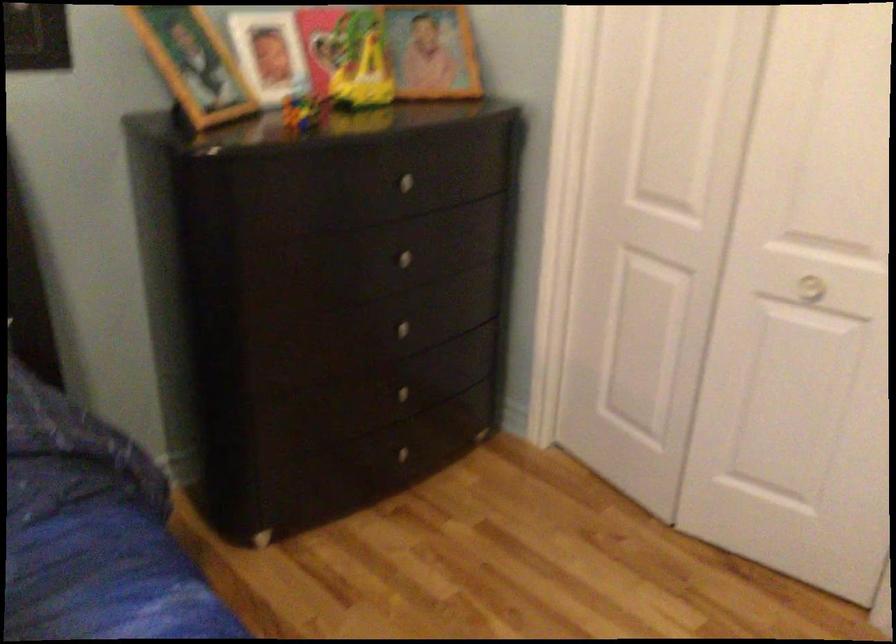
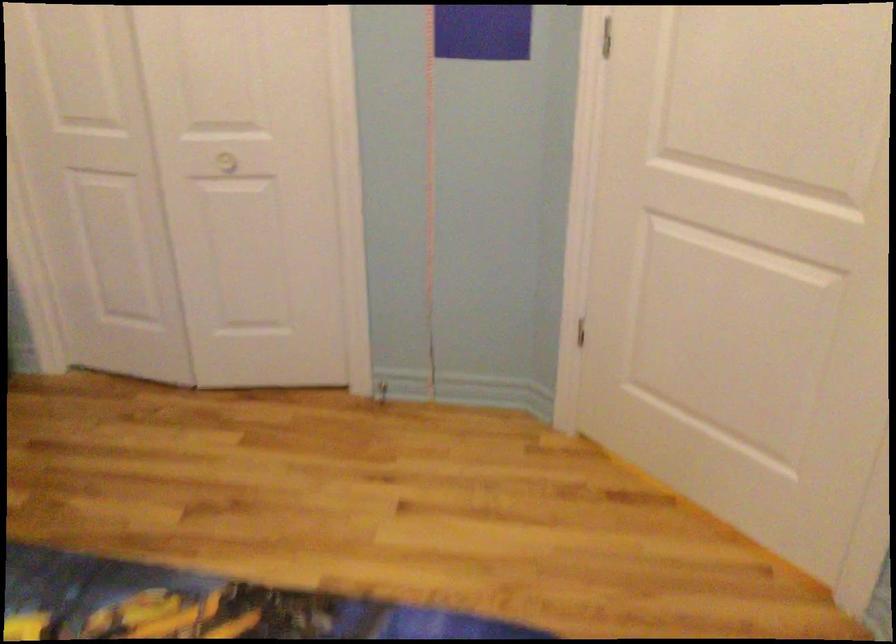
In the second image, find the point that corresponds to [812,295] in the first image.

(227, 162)